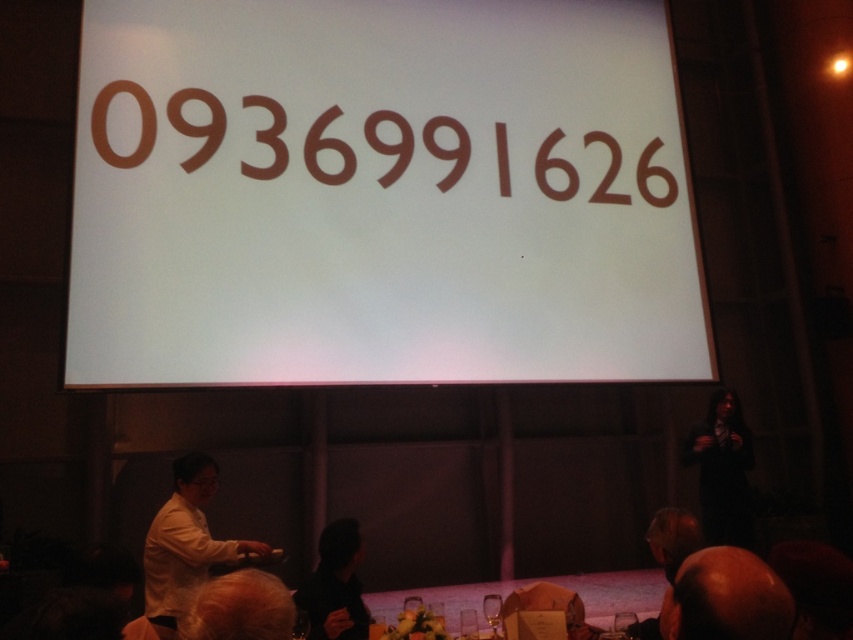
You are a photographer at the event and want to capture a photo of both the white matte shirt at lower left and the black matte hair at lower center. Since the lighting is dim, you need to ensure both are visible. Which object should you focus on first to ensure proper exposure?

The white matte shirt at lower left is positioned under black matte hair at lower center. Therefore, focusing on the black matte hair at lower center first would ensure proper exposure since it is closer to the camera and likely better lit due to its position above the shirt.

You are an event planner organizing a presentation in this room. You need to place a projector to display content on the large projection screen. Considering the current setup, where should you position the projector relative to the point labeled as point (380, 195) to ensure the screen is properly illuminated?

The point (380, 195) indicates brown paper like at upper center. Since the projection screen is in the background, the projector should be placed in front of the point (380, 195) to ensure proper illumination.